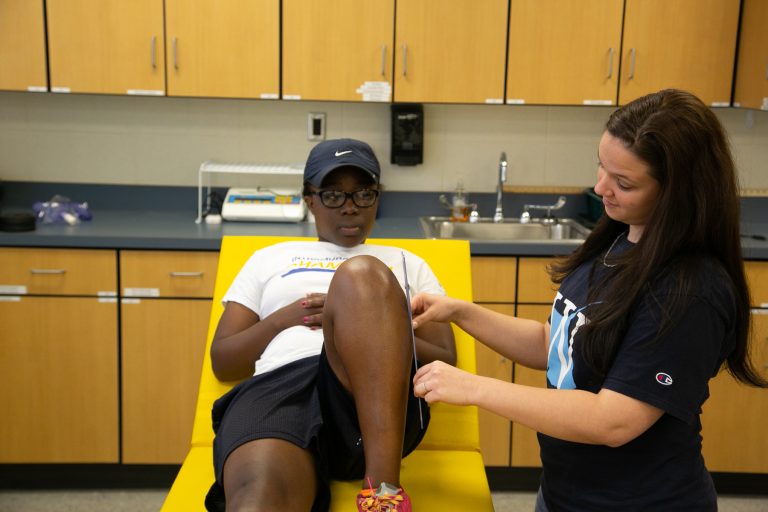
You are a GUI agent. You are given a task and a screenshot of the screen. Output one action in this format:
    pyautogui.click(x=<x>, y=<y>)
    Task: Click on the floor
    
    Given the screenshot: What is the action you would take?
    pyautogui.click(x=140, y=497), pyautogui.click(x=515, y=498), pyautogui.click(x=743, y=500)